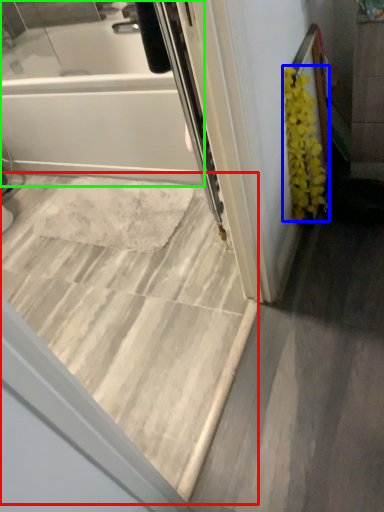
Question: Based on their relative distances, which object is farther from stairwell (highlighted by a red box)? Choose from flower (highlighted by a blue box) and bathtub (highlighted by a green box).

Choices:
 (A) flower
 (B) bathtub

Answer: (A)